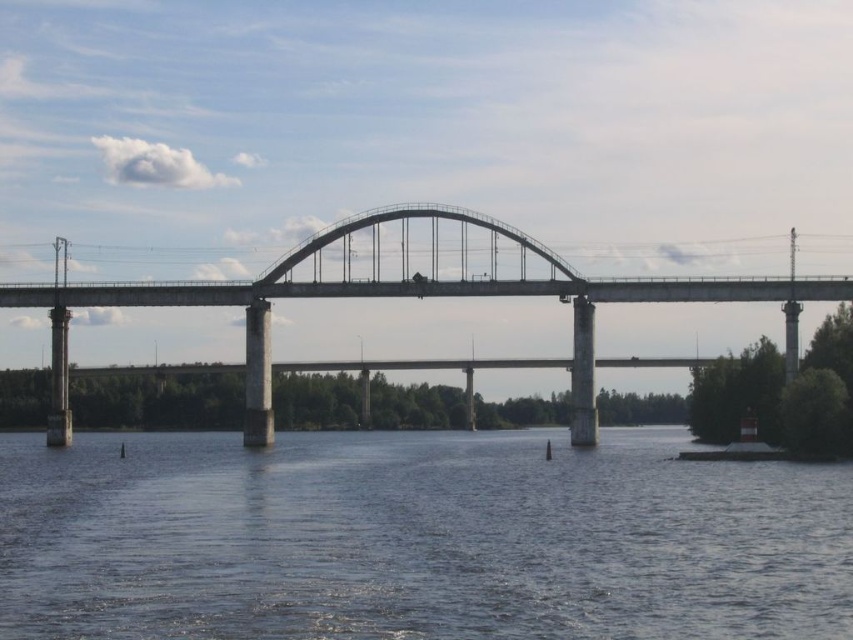
You are a delivery drone that needs to fly from the starting point to the destination. The drone has a maximum flight range of 70 feet. You observe the dark blue water at center and the concrete bridge at center in the scene. Can you safely make the trip without needing to recharge?

The distance between the dark blue water at center and the concrete bridge at center is 72.96 feet. Since the drone can only fly 70 feet before needing to recharge, it cannot safely make the trip without recharging.